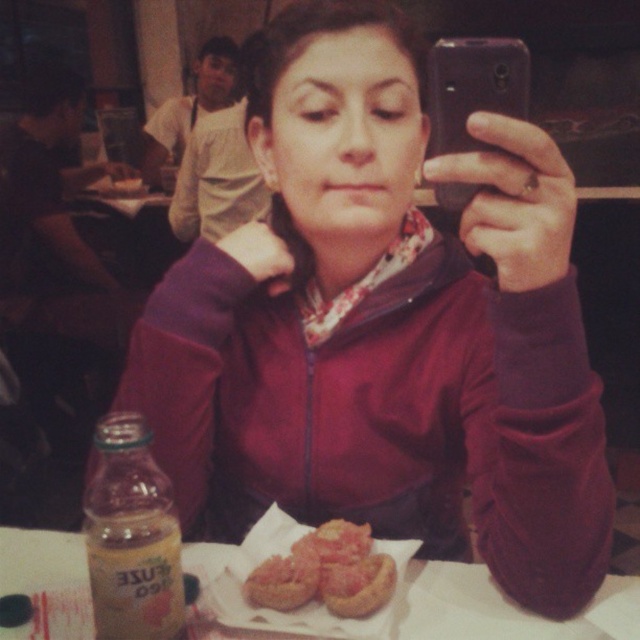
What is located at the coordinates point [324,572] in the image?

The golden crispy bread at center is located at point [324,572].

From the picture: What is located at the coordinates point [356,586] in the image?

The point at coordinates [356,586] marks the golden brown bread at lower center.